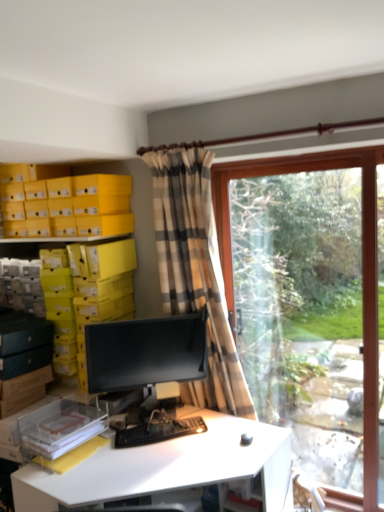
I want to click on free location above black matte keyboard at center (from a real-world perspective), so click(158, 429).